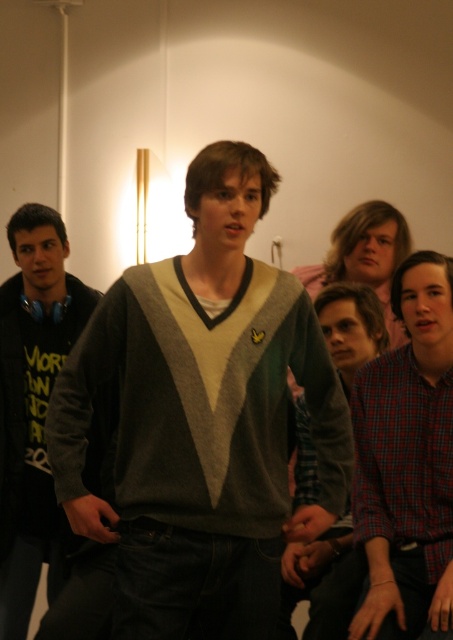
Between point (279, 550) and point (78, 324), which one is positioned behind?

The point (78, 324) is behind.

How far apart are knit sweater at center and black matte hoodie at left?

28.49 inches

I want to click on knit sweater at center, so click(x=202, y=419).

Locate an element on the screen. This screenshot has width=453, height=640. knit sweater at center is located at coordinates (202, 419).

Which of these two, knit sweater at center or plaid shirt at center, stands taller?

knit sweater at center is taller.

Between point (135, 614) and point (422, 435), which one is positioned behind?

Positioned behind is point (422, 435).

You are a GUI agent. You are given a task and a screenshot of the screen. Output one action in this format:
    pyautogui.click(x=<x>, y=<y>)
    Task: Click on the knit sweater at center
    
    Given the screenshot: What is the action you would take?
    pyautogui.click(x=202, y=419)

Which is more to the right, plaid shirt at center or black matte hoodie at left?

Positioned to the right is plaid shirt at center.

Is point (386, 358) farther from camera compared to point (37, 525)?

No, it is not.

Where is `plaid shirt at center`? The height and width of the screenshot is (640, 453). plaid shirt at center is located at coordinates (408, 461).